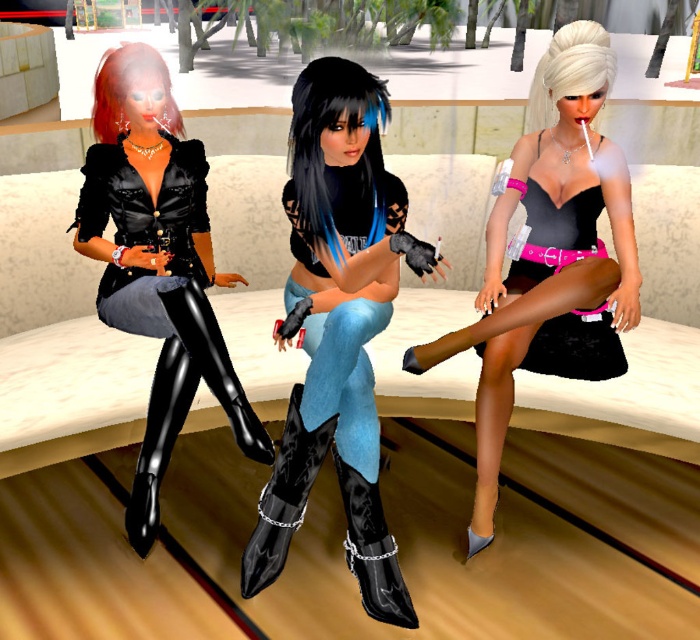
You are a fashion designer observing the characters in the image. You need to decide which item would require more material to create between the glossy patent leather boot at center and the white silky hair at upper center. Based on their sizes, which one would need more material?

The glossy patent leather boot at center has a larger size compared to the white silky hair at upper center, so it would require more material to create.